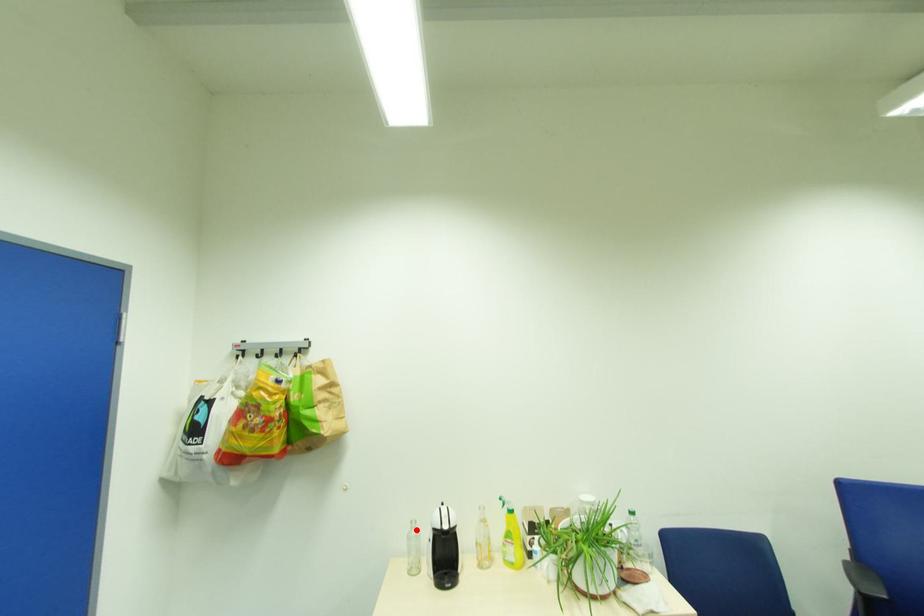
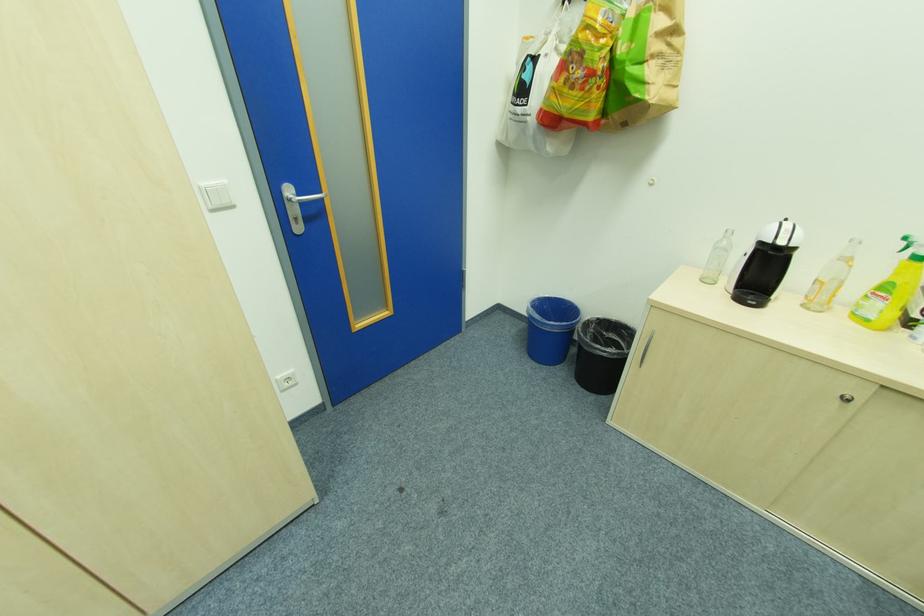
Question: I am providing you with two images of the same scene from different viewpoints. A red point is marked on the first image. At the location where the point appears in image 1, is it still visible in image 2?

Choices:
 (A) Yes
 (B) No

Answer: (A)